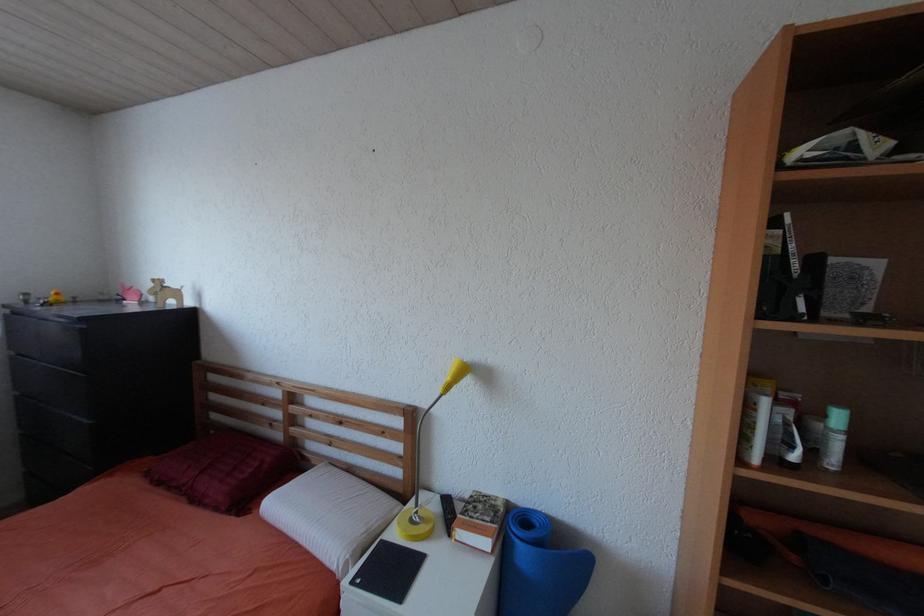
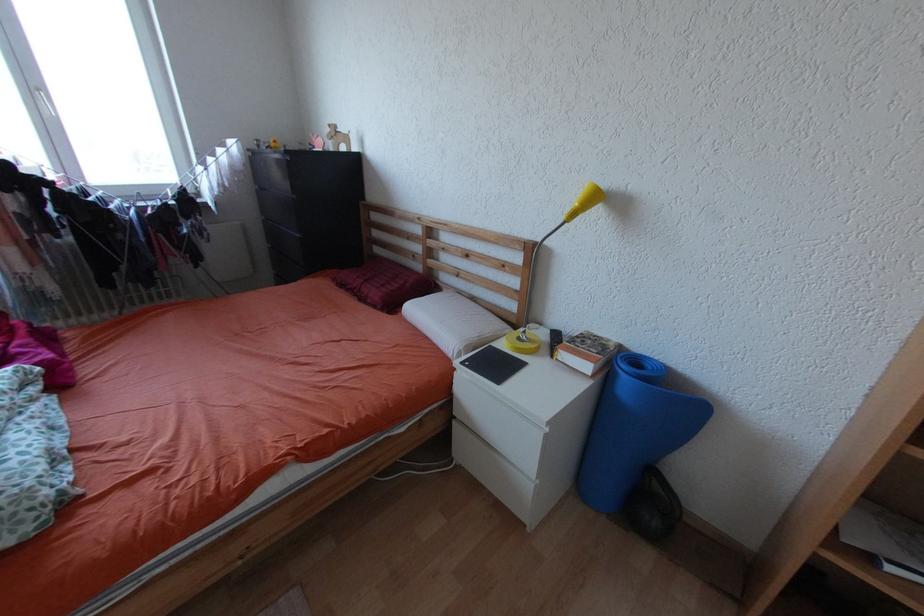
First-person continuous shooting, in which direction is the camera rotating?

The camera's rotation is toward left-down.